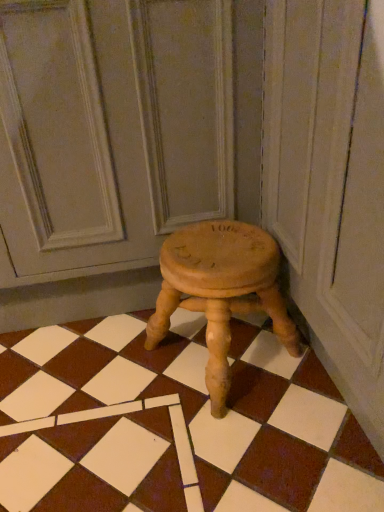
Question: Is wooden stool at center to the left of wooden stool at center from the viewer's perspective?

Choices:
 (A) yes
 (B) no

Answer: (A)

Question: Does wooden stool at center lie in front of wooden stool at center?

Choices:
 (A) yes
 (B) no

Answer: (A)

Question: Considering the relative sizes of wooden stool at center and wooden stool at center in the image provided, is wooden stool at center shorter than wooden stool at center?

Choices:
 (A) no
 (B) yes

Answer: (B)

Question: Considering the relative positions of wooden stool at center and wooden stool at center in the image provided, is wooden stool at center to the right of wooden stool at center from the viewer's perspective?

Choices:
 (A) yes
 (B) no

Answer: (B)

Question: Does wooden stool at center have a larger size compared to wooden stool at center?

Choices:
 (A) no
 (B) yes

Answer: (B)

Question: Is wooden stool at center positioned behind wooden stool at center?

Choices:
 (A) no
 (B) yes

Answer: (A)

Question: Is wooden stool at center facing away from natural wood stool at center?

Choices:
 (A) no
 (B) yes

Answer: (B)

Question: Is wooden stool at center not near natural wood stool at center?

Choices:
 (A) no
 (B) yes

Answer: (A)

Question: Is wooden stool at center behind natural wood stool at center?

Choices:
 (A) no
 (B) yes

Answer: (B)

Question: From the image's perspective, is wooden stool at center located beneath natural wood stool at center?

Choices:
 (A) yes
 (B) no

Answer: (A)

Question: Could you tell me if wooden stool at center is facing natural wood stool at center?

Choices:
 (A) no
 (B) yes

Answer: (A)

Question: Can you confirm if wooden stool at center is positioned to the right of natural wood stool at center?

Choices:
 (A) yes
 (B) no

Answer: (A)

Question: Is wooden stool at center at the back of natural wood stool at center?

Choices:
 (A) yes
 (B) no

Answer: (B)